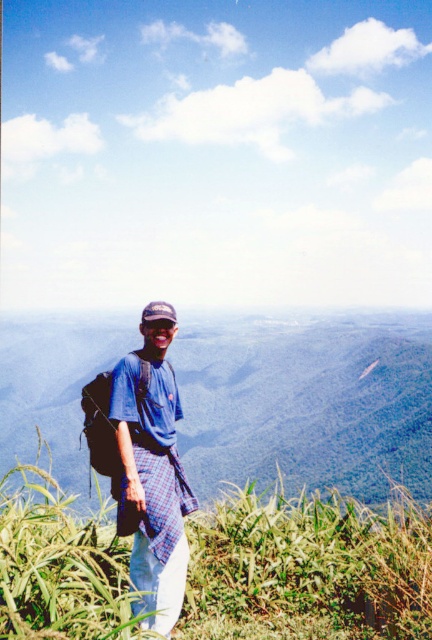
You are hiking and want to take a photo of the green leafy mountain at center and the green grass at lower left. Which object should you focus on first if you want both to be in clear focus?

To ensure both the green leafy mountain at center and the green grass at lower left are in clear focus, focus on the green leafy mountain at center first since it is farther away. This technique leverages the depth of field so that closer objects like the green grass at lower left will also be sharp.

You are a drone operator trying to capture the green leafy mountain at center from above. The drone can only hover at a fixed altitude. To ensure the mountain is centered in the photo, where should you position the drone relative to the mountain?

The green leafy mountain at center is already positioned at the center point of the image at coordinates (307, 401), so the drone should hover directly above the mountain to keep it centered in the photo.